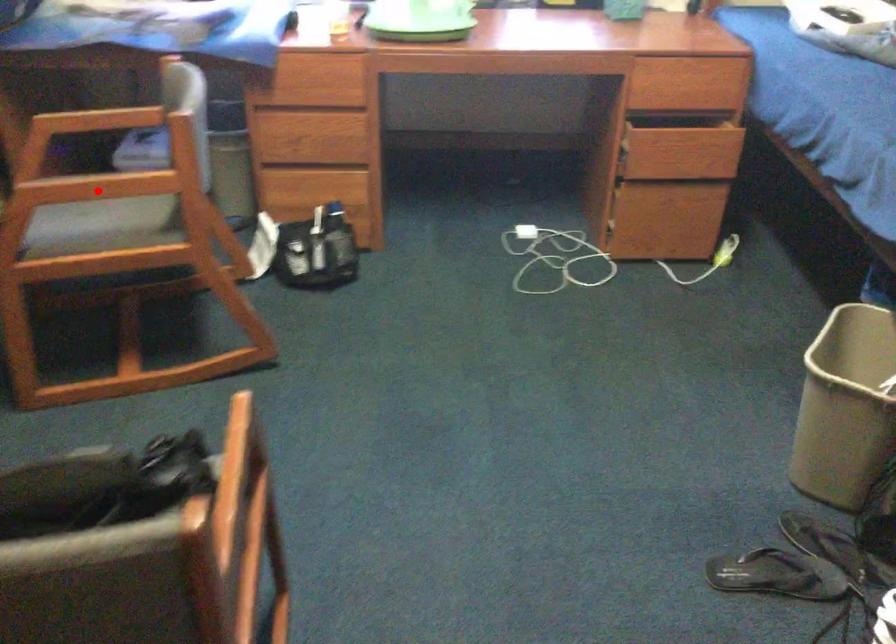
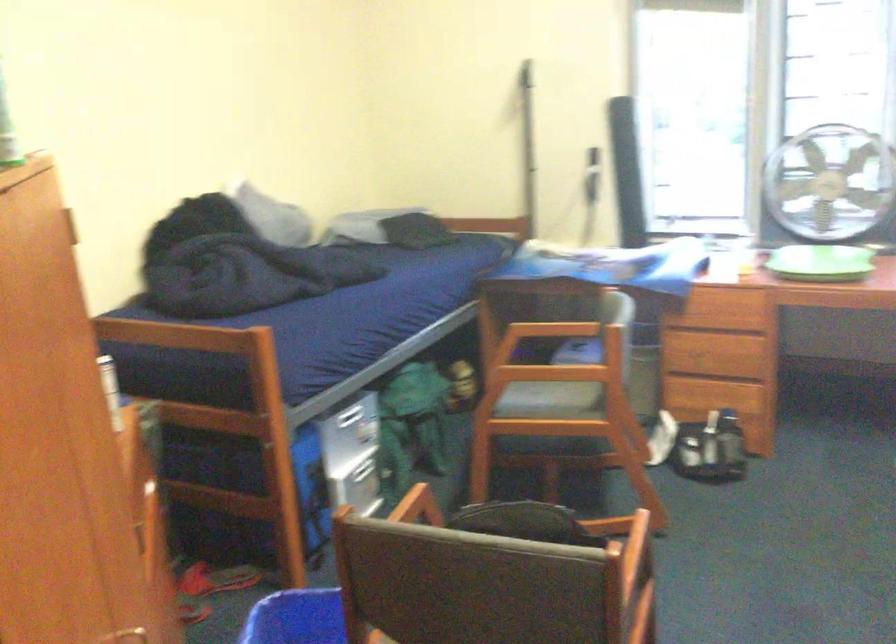
Where in the second image is the point corresponding to the highlighted location from the first image?

(540, 375)